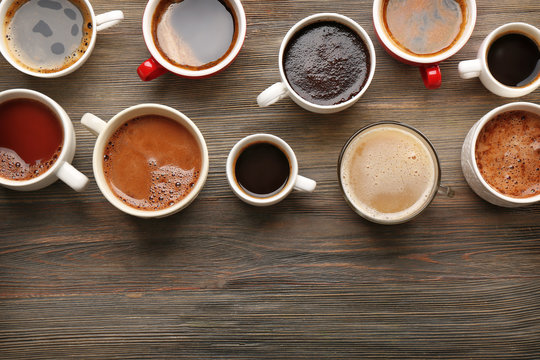
What are the coordinates of `handles on coffee mugs` in the screenshot? It's located at (74, 177), (100, 13), (97, 121), (274, 97), (298, 183), (467, 75), (434, 77).